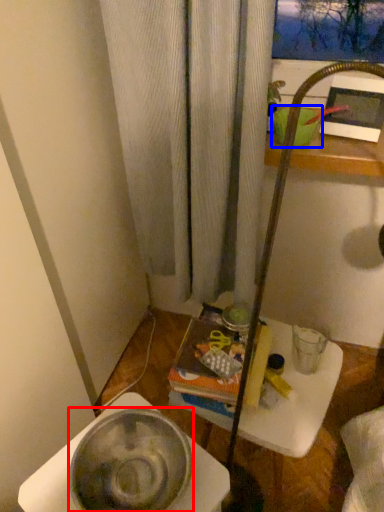
Question: Which point is further to the camera, basin (highlighted by a red box) or basin (highlighted by a blue box)?

Choices:
 (A) basin
 (B) basin

Answer: (B)